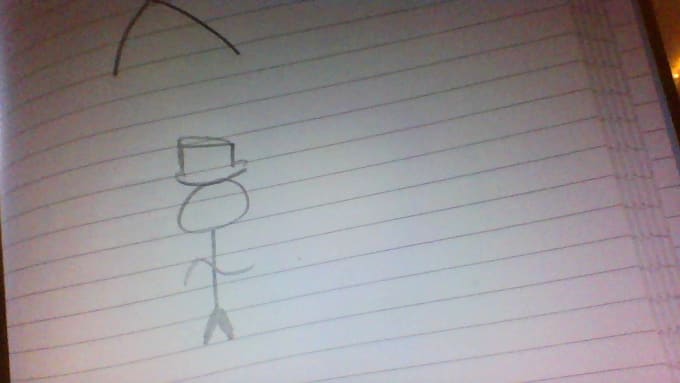
Locate an element on the screen. light source is located at coordinates (676, 75).